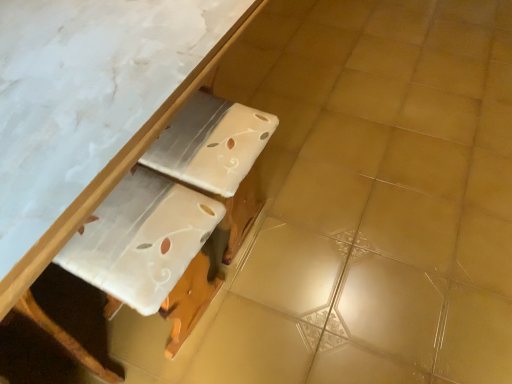
This screenshot has width=512, height=384. Identify the location of white glossy table at upper center. (105, 154).

The width and height of the screenshot is (512, 384). What do you see at coordinates (105, 154) in the screenshot? I see `white glossy table at upper center` at bounding box center [105, 154].

In order to face white glossy cardboard at center, should I rotate leftwards or rightwards?

Turn left approximately 13.635 degrees to face it.

The width and height of the screenshot is (512, 384). What do you see at coordinates (142, 239) in the screenshot?
I see `white glossy cardboard at center` at bounding box center [142, 239].

At what (x,y) coordinates should I click in order to perform the action: click on white glossy cardboard at center. Please return your answer as a coordinate pair (x, y). Image resolution: width=512 pixels, height=384 pixels. Looking at the image, I should click on (142, 239).

This screenshot has width=512, height=384. Identify the location of white glossy table at upper center. (105, 154).

Which object is positioned more to the left, white glossy cardboard at center or white glossy table at upper center?

From the viewer's perspective, white glossy table at upper center appears more on the left side.

Is white glossy cardboard at center further to the viewer compared to white glossy table at upper center?

Yes, white glossy cardboard at center is behind white glossy table at upper center.

Is point (122, 246) closer to camera compared to point (121, 138)?

No, (122, 246) is behind (121, 138).

From the image's perspective, who appears lower, white glossy cardboard at center or white glossy table at upper center?

white glossy cardboard at center, from the image's perspective.

From a real-world perspective, between white glossy cardboard at center and white glossy table at upper center, who is vertically higher?

In real-world perspective, white glossy table at upper center is above.

From the picture: Considering the sizes of white glossy cardboard at center and white glossy table at upper center in the image, is white glossy cardboard at center wider or thinner than white glossy table at upper center?

In the image, white glossy cardboard at center appears to be more narrow than white glossy table at upper center.

Is white glossy cardboard at center taller or shorter than white glossy table at upper center?

Considering their sizes, white glossy cardboard at center has less height than white glossy table at upper center.

Can you confirm if white glossy cardboard at center is bigger than white glossy table at upper center?

No, white glossy cardboard at center is not bigger than white glossy table at upper center.

Is white glossy cardboard at center not within white glossy table at upper center?

Actually, white glossy cardboard at center is within white glossy table at upper center.

In the scene shown: Is white glossy cardboard at center far from white glossy table at upper center?

No, white glossy cardboard at center is in close proximity to white glossy table at upper center.

Is white glossy table at upper center at the back of white glossy cardboard at center?

Yes, white glossy cardboard at center is positioned with its back facing white glossy table at upper center.

What's the angular difference between white glossy cardboard at center and white glossy table at upper center's facing directions?

The facing directions of white glossy cardboard at center and white glossy table at upper center are 177 degrees apart.

At what (x,y) coordinates should I click in order to perform the action: click on table positioned vertically above the white glossy cardboard at center (from a real-world perspective). Please return your answer as a coordinate pair (x, y). The image size is (512, 384). Looking at the image, I should click on (105, 154).

Between white glossy table at upper center and white glossy cardboard at center, which one appears on the left side from the viewer's perspective?

From the viewer's perspective, white glossy table at upper center appears more on the left side.

In the scene shown: Considering their positions, is white glossy table at upper center located in front of or behind white glossy cardboard at center?

In the image, white glossy table at upper center appears in front of white glossy cardboard at center.

Is point (52, 125) closer or farther from the camera than point (188, 230)?

Point (52, 125) is closer to the camera than point (188, 230).

From the image's perspective, which is below, white glossy table at upper center or white glossy cardboard at center?

white glossy cardboard at center appears lower in the image.

From a real-world perspective, which object rests below the other?

white glossy cardboard at center.

Considering the relative sizes of white glossy table at upper center and white glossy cardboard at center in the image provided, is white glossy table at upper center wider than white glossy cardboard at center?

Indeed, white glossy table at upper center has a greater width compared to white glossy cardboard at center.

Consider the image. Is white glossy table at upper center shorter than white glossy cardboard at center?

In fact, white glossy table at upper center may be taller than white glossy cardboard at center.

From the picture: Which of these two, white glossy table at upper center or white glossy cardboard at center, is smaller?

Smaller between the two is white glossy cardboard at center.

Is white glossy table at upper center completely or partially outside of white glossy cardboard at center?

Indeed, white glossy table at upper center is completely outside white glossy cardboard at center.

Is there a large distance between white glossy table at upper center and white glossy cardboard at center?

Actually, white glossy table at upper center and white glossy cardboard at center are a little close together.

Is white glossy table at upper center facing away from white glossy cardboard at center?

white glossy table at upper center does not have its back to white glossy cardboard at center.

How different are the orientations of white glossy table at upper center and white glossy cardboard at center in degrees?

The angle between the facing direction of white glossy table at upper center and the facing direction of white glossy cardboard at center is 177 degrees.

Locate an element on the screen. The height and width of the screenshot is (384, 512). table that appears above the white glossy cardboard at center (from a real-world perspective) is located at coordinates (105, 154).

Where is `table above the white glossy cardboard at center (from the image's perspective)`? This screenshot has height=384, width=512. table above the white glossy cardboard at center (from the image's perspective) is located at coordinates (105, 154).

This screenshot has width=512, height=384. I want to click on table in front of the white glossy cardboard at center, so click(105, 154).